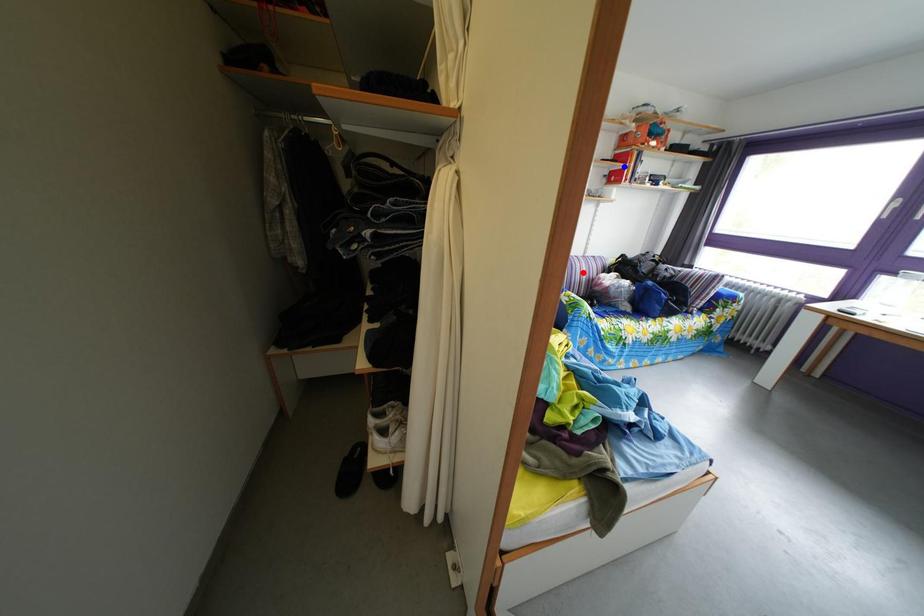
Question: Two points are marked on the image. Which point is closer to the camera?

Choices:
 (A) Blue point is closer.
 (B) Red point is closer.

Answer: (B)